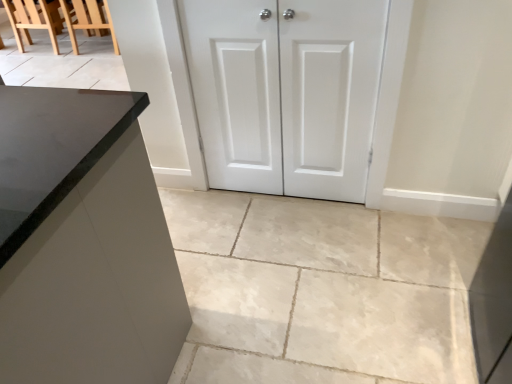
Question: Should I look upward or downward to see slate gray stone countertop at left?

Choices:
 (A) down
 (B) up

Answer: (B)

Question: Can white matte cabinet doors at center be found inside slate gray stone countertop at left?

Choices:
 (A) no
 (B) yes

Answer: (A)

Question: Can you confirm if slate gray stone countertop at left is wider than white matte cabinet doors at center?

Choices:
 (A) no
 (B) yes

Answer: (B)

Question: From a real-world perspective, is slate gray stone countertop at left below white matte cabinet doors at center?

Choices:
 (A) no
 (B) yes

Answer: (A)

Question: Can you confirm if slate gray stone countertop at left is bigger than white matte cabinet doors at center?

Choices:
 (A) no
 (B) yes

Answer: (B)

Question: Does slate gray stone countertop at left have a smaller size compared to white matte cabinet doors at center?

Choices:
 (A) yes
 (B) no

Answer: (B)

Question: Does slate gray stone countertop at left turn towards white matte cabinet doors at center?

Choices:
 (A) yes
 (B) no

Answer: (B)

Question: Is wooden chair at upper left, acting as the first chair starting from the left, far from slate gray stone countertop at left?

Choices:
 (A) no
 (B) yes

Answer: (B)

Question: Is wooden chair at upper left, which is counted as the 2th chair, starting from the right, aimed at slate gray stone countertop at left?

Choices:
 (A) no
 (B) yes

Answer: (A)

Question: Is wooden chair at upper left, acting as the first chair starting from the left, taller than slate gray stone countertop at left?

Choices:
 (A) no
 (B) yes

Answer: (A)

Question: Can you confirm if wooden chair at upper left, which is counted as the 2th chair, starting from the right, is smaller than slate gray stone countertop at left?

Choices:
 (A) yes
 (B) no

Answer: (A)

Question: From a real-world perspective, is wooden chair at upper left, acting as the first chair starting from the left, located beneath slate gray stone countertop at left?

Choices:
 (A) yes
 (B) no

Answer: (A)

Question: Is slate gray stone countertop at left at the back of wooden chair at upper left, acting as the first chair starting from the left?

Choices:
 (A) no
 (B) yes

Answer: (A)

Question: Is slate gray stone countertop at left thinner than white matte cabinet doors at center?

Choices:
 (A) yes
 (B) no

Answer: (B)